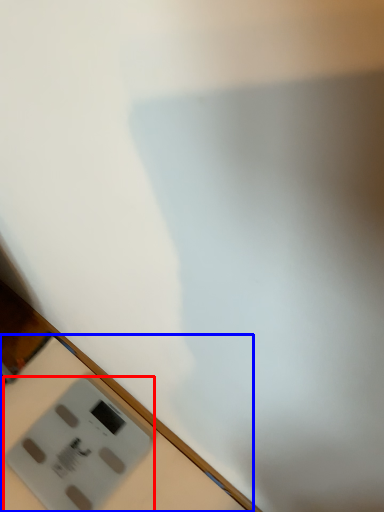
Question: Which object appears closest to the camera in this image, power plugs and sockets (highlighted by a red box) or table (highlighted by a blue box)?

Choices:
 (A) power plugs and sockets
 (B) table

Answer: (B)